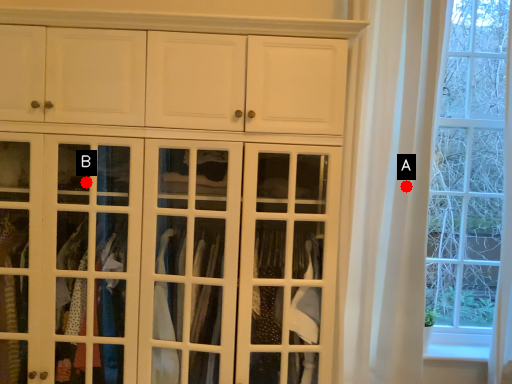
Question: Two points are circled on the image, labeled by A and B beside each circle. Which point is farther to the camera?

Choices:
 (A) A is further
 (B) B is further

Answer: (A)